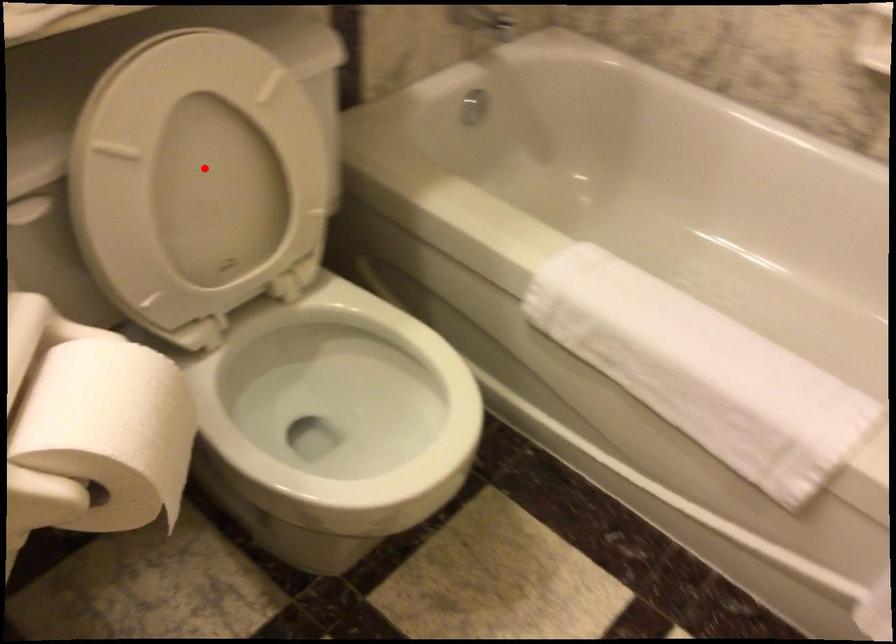
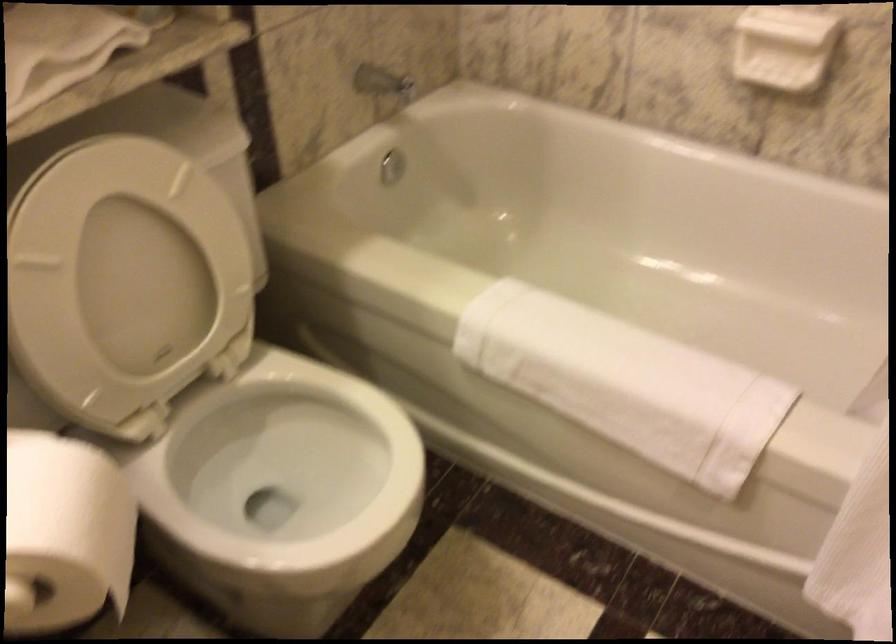
Find the pixel in the second image that matches the highlighted location in the first image.

(126, 266)